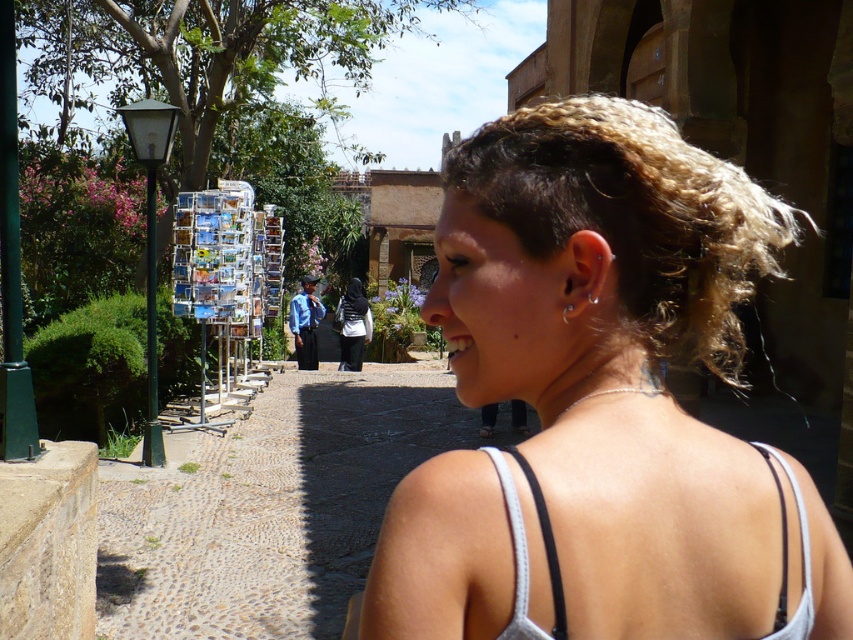
Question: Is blonde hair at upper right wider than silver metallic earring at ear?

Choices:
 (A) yes
 (B) no

Answer: (A)

Question: Which object is closer to the camera taking this photo?

Choices:
 (A) blonde curly hair at upper right
 (B) black fabric hijab at center

Answer: (A)

Question: Estimate the real-world distances between objects in this image. Which object is farther from the blonde curly hair at upper right?

Choices:
 (A) silver metallic earring at ear
 (B) blonde hair at upper right

Answer: (A)

Question: Is blonde curly hair at upper right in front of silver metallic earring at ear?

Choices:
 (A) yes
 (B) no

Answer: (B)

Question: Which is nearer to the blonde curly hair at upper right?

Choices:
 (A) black fabric hijab at center
 (B) blonde hair at upper right

Answer: (B)

Question: Does blonde hair at upper right have a lesser width compared to silver metallic earring at ear?

Choices:
 (A) yes
 (B) no

Answer: (B)